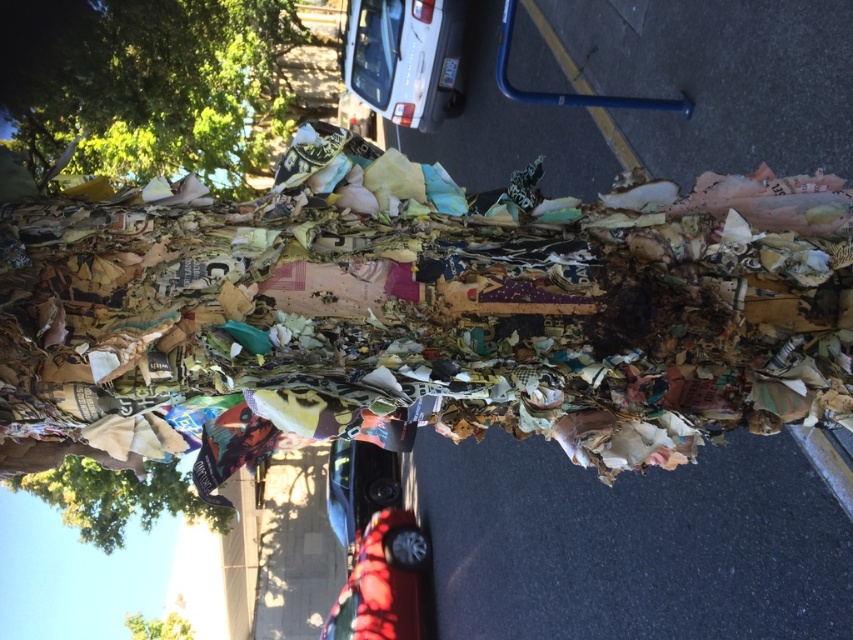
You are standing in a park and see the green leafy tree at upper left and the brown paper tree at lower left. Which tree is taller?

The green leafy tree at upper left is taller than the brown paper tree at lower left.

You are standing in a park and see the green leafy tree at upper left and the shiny red car at center. Which object is bigger in size?

The green leafy tree at upper left is larger in size compared to the shiny red car at center.

You are standing in front of the tree trunk covered with paper. There are two points marked on the trunk, one at coordinates point [201,125] and another at point [149,481]. Which point is closer to you?

Point [149,481] is closer to you because it is less further to the camera than point [201,125].